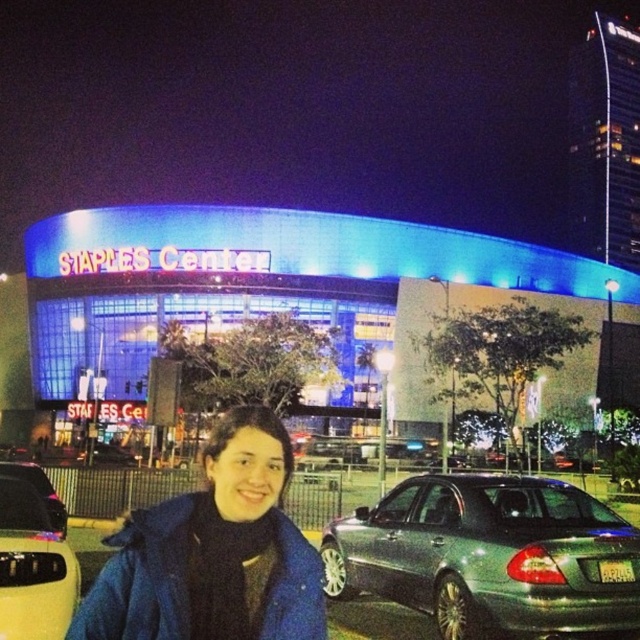
You are a photographer trying to capture a wide shot of the Staples Center at night. You notice the blue fleece jacket at center and the metallic silver sedan at lower left in your frame. Based on their sizes in the image, which object would appear more prominent in the photo?

The blue fleece jacket at center appears more prominent in the photo because its width is larger than that of the metallic silver sedan at lower left.

You are standing at the center of the Staples Center entrance and want to take a photo of the metallic silver sedan at center. Which direction should you face to capture it in your shot?

Since the metallic silver sedan at center is located at point (x=490, y=556), you should face towards the center area to capture it in your shot.

You are standing next to the blue illuminated building at center and want to cross the street to reach the other side. The crosswalk is 64.70 meters away. If you walk at a speed of 1.5 meters per second, how many seconds will it take you to reach the crosswalk?

The crosswalk is 64.70 meters away from the blue illuminated building at center. At a walking speed of 1.5 meters per second, it will take approximately 43.13 seconds to reach the crosswalk.